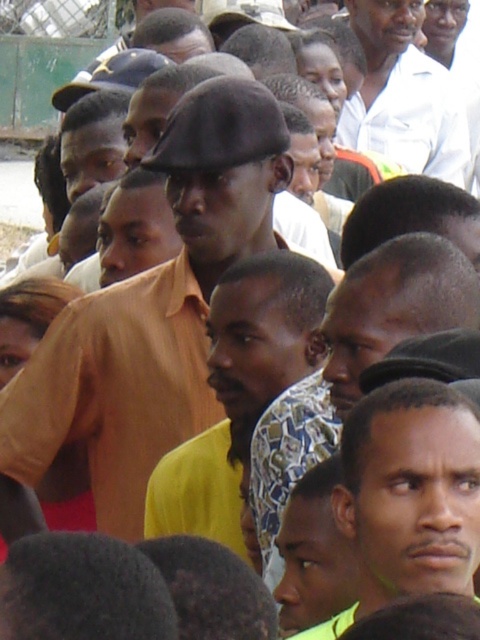
You are a photographer trying to capture a photo of the matte yellow shirt at center and the white shirt at upper center. Which of the two shirts should you focus on first if you want to capture them in order from left to right?

The matte yellow shirt at center is positioned on the left side of the white shirt at upper center, so you should focus on the matte yellow shirt at center first to capture them from left to right.

You are a photographer standing at the back of the crowd. You want to take a photo of the matte yellow shirt at center and the white shirt at upper center. Considering their distance apart, will the two shirts be visible in the same frame?

The matte yellow shirt at center is 104.82 feet from the white shirt at upper center. At this distance, it is unlikely both shirts will be visible in the same frame unless using a wide angle lens.

You are a photographer trying to capture a clear shot of the matte yellow shirt at center and the white shirt at upper center. Which of these two shirts is positioned lower in the frame?

The matte yellow shirt at center is positioned lower in the frame than the white shirt at upper center.